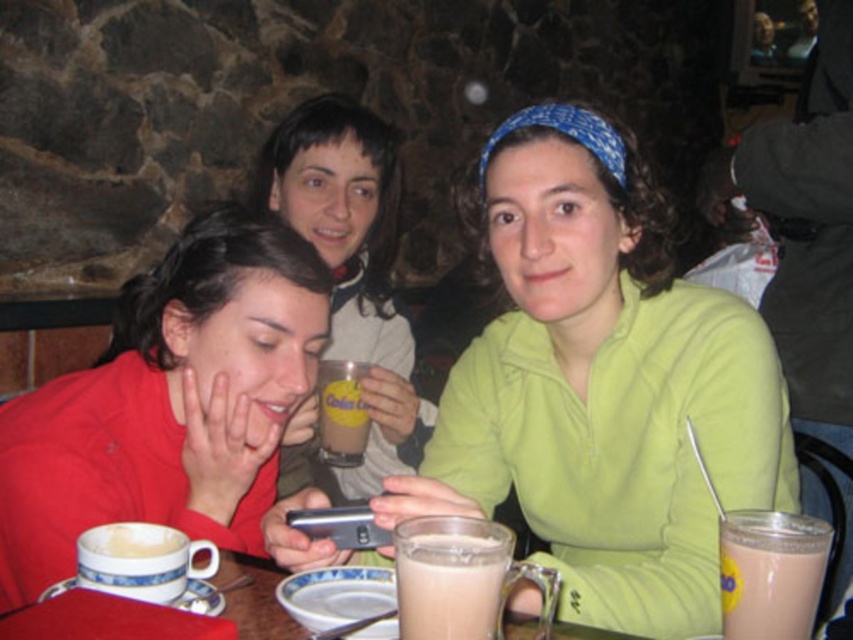
Question: In this image, where is matte red shirt at left located relative to milkshake glass at lower center?

Choices:
 (A) above
 (B) below

Answer: (A)

Question: Is milkshake glass at lower center wider than matte plastic cup at center?

Choices:
 (A) no
 (B) yes

Answer: (B)

Question: Does matte ceramic mug at center come in front of matte plastic cup at center?

Choices:
 (A) yes
 (B) no

Answer: (A)

Question: Which object is positioned closest to the green matte shirt at center?

Choices:
 (A) matte plastic cup at center
 (B) white frothy coffee at lower left
 (C) white ceramic mug at lower left
 (D) matte ceramic mug at center

Answer: (D)

Question: Which object appears closest to the camera in this image?

Choices:
 (A) milkshake glass at lower center
 (B) milky frothy drink at lower right
 (C) matte red shirt at left

Answer: (A)

Question: Which point is farther to the camera?

Choices:
 (A) (616, 259)
 (B) (79, 550)
 (C) (262, 337)
 (D) (103, 564)

Answer: (A)